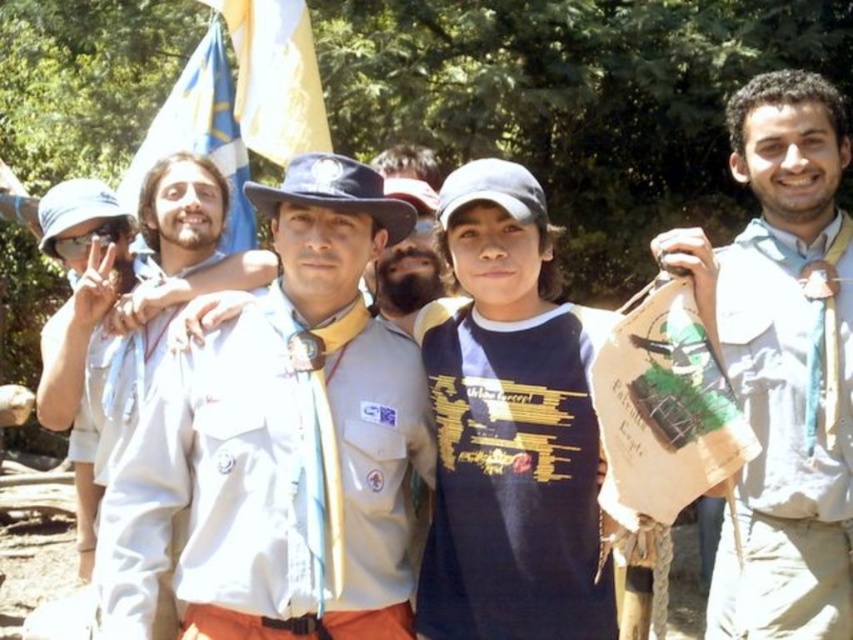
Based on the photo, you are a photographer trying to capture a clear shot of the blue fabric flag at upper left without any obstructions. Given the presence of the white fabric shirt at left, can you determine if the flag will be visible in your photo?

The white fabric shirt at left is in front of the blue fabric flag at upper left, so the flag will be partially or fully obstructed by the shirt and may not be clearly visible in the photo.